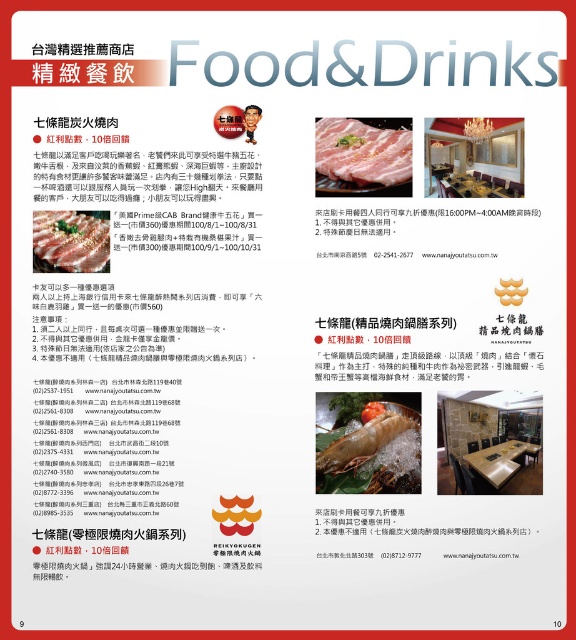
You are a customer looking at the promotional flyer for the restaurant. In the middle section, there are two main sections. The left section has white glossy prawns at center and matte black table at center. Which object is closer to you?

The white glossy prawns at center are closer to you because they are positioned further to the viewer than the matte black table at center.